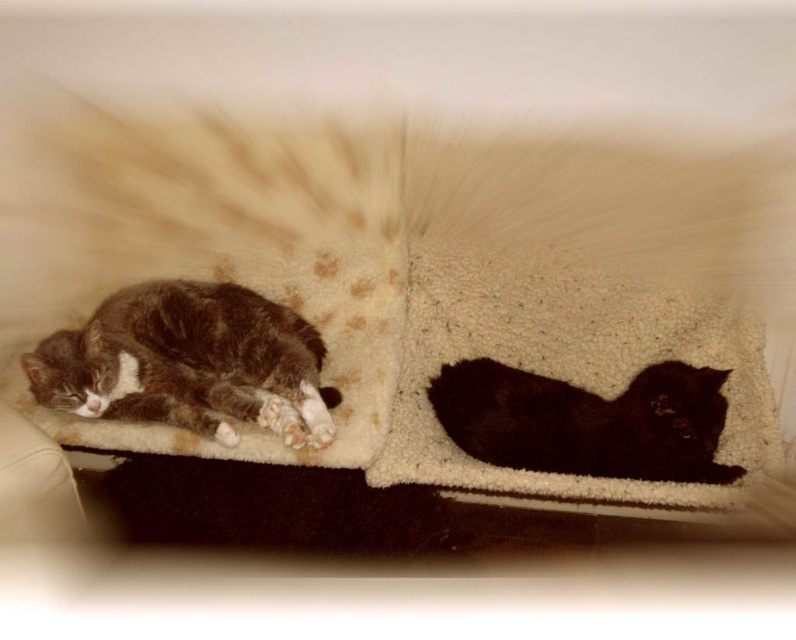
Question: Is gray fur cat at left to the left of shiny black cat at center from the viewer's perspective?

Choices:
 (A) no
 (B) yes

Answer: (B)

Question: Which point is closer to the camera?

Choices:
 (A) (611, 417)
 (B) (190, 308)

Answer: (A)

Question: Among these points, which one is nearest to the camera?

Choices:
 (A) (330, 438)
 (B) (654, 401)

Answer: (B)

Question: Does gray fur cat at left lie in front of shiny black cat at center?

Choices:
 (A) no
 (B) yes

Answer: (B)

Question: Can you confirm if gray fur cat at left is bigger than shiny black cat at center?

Choices:
 (A) yes
 (B) no

Answer: (A)